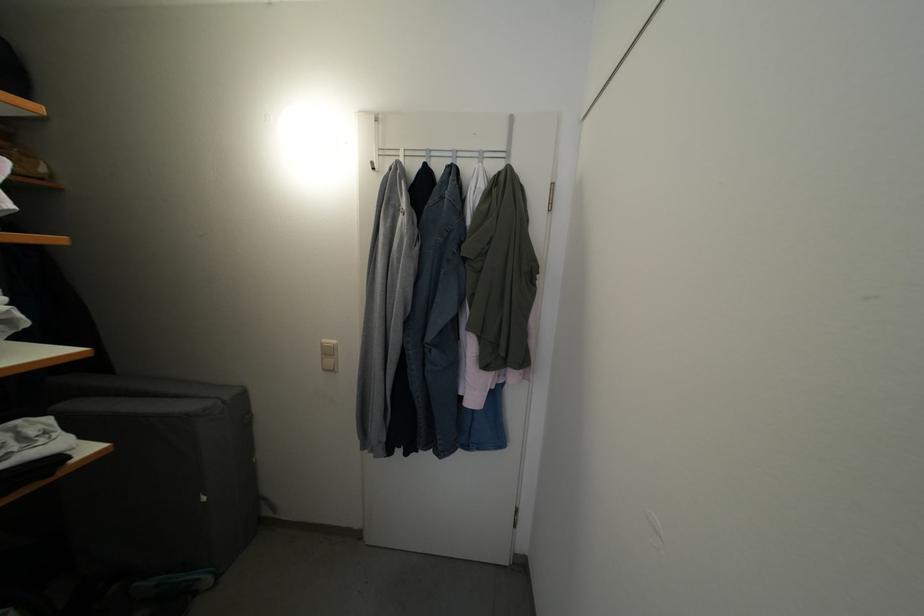
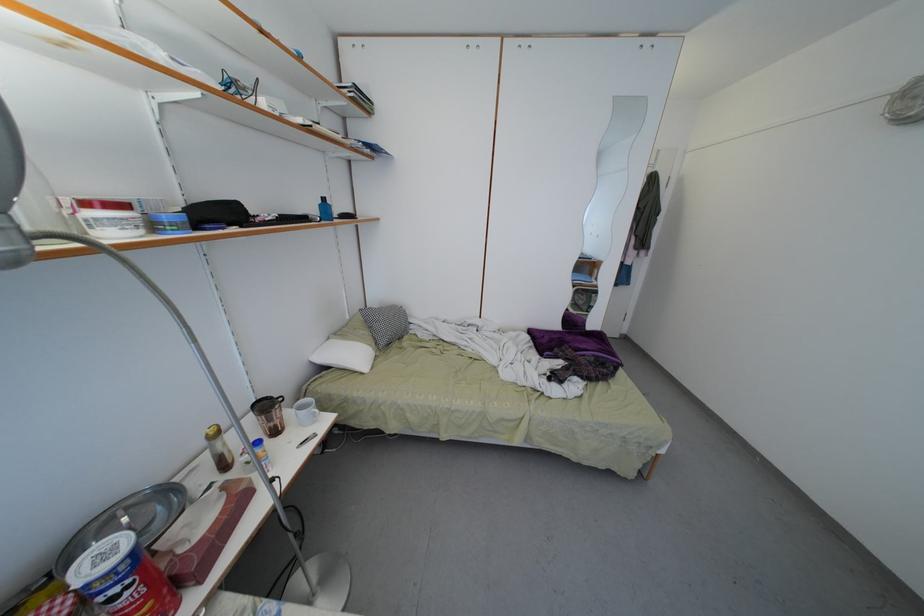
In a continuous first-person perspective shot, in which direction is the camera moving?

The cameraman moved toward left, backward.